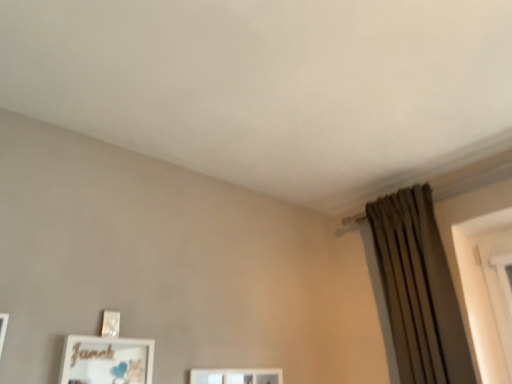
This screenshot has height=384, width=512. What do you see at coordinates (419, 290) in the screenshot?
I see `brown textured curtain at right` at bounding box center [419, 290].

The image size is (512, 384). Find the location of `brown textured curtain at right`. brown textured curtain at right is located at coordinates (419, 290).

Image resolution: width=512 pixels, height=384 pixels. In order to click on matte gold picture frame at lower left in this screenshot , I will do `click(106, 360)`.

What do you see at coordinates (106, 360) in the screenshot? The height and width of the screenshot is (384, 512). I see `matte gold picture frame at lower left` at bounding box center [106, 360].

The width and height of the screenshot is (512, 384). I want to click on brown textured curtain at right, so click(x=419, y=290).

Visually, is brown textured curtain at right positioned to the left or to the right of matte gold picture frame at lower left?

brown textured curtain at right is to the right of matte gold picture frame at lower left.

Which object is more forward, brown textured curtain at right or matte gold picture frame at lower left?

matte gold picture frame at lower left is more forward.

Is point (425, 227) closer or farther from the camera than point (140, 368)?

Point (425, 227).

From the image's perspective, between brown textured curtain at right and matte gold picture frame at lower left, who is located below?

matte gold picture frame at lower left, from the image's perspective.

From a real-world perspective, which is physically above, brown textured curtain at right or matte gold picture frame at lower left?

brown textured curtain at right, from a real-world perspective.

Can you confirm if brown textured curtain at right is thinner than matte gold picture frame at lower left?

No.

Can you confirm if brown textured curtain at right is taller than matte gold picture frame at lower left?

Indeed, brown textured curtain at right has a greater height compared to matte gold picture frame at lower left.

Considering the sizes of brown textured curtain at right and matte gold picture frame at lower left in the image, is brown textured curtain at right bigger or smaller than matte gold picture frame at lower left?

In the image, brown textured curtain at right appears to be larger than matte gold picture frame at lower left.

Is brown textured curtain at right inside the boundaries of matte gold picture frame at lower left, or outside?

brown textured curtain at right is outside matte gold picture frame at lower left.

Is brown textured curtain at right not near matte gold picture frame at lower left?

Yes, brown textured curtain at right and matte gold picture frame at lower left are located far from each other.

Does brown textured curtain at right turn towards matte gold picture frame at lower left?

No, brown textured curtain at right does not turn towards matte gold picture frame at lower left.

Can you tell me how much brown textured curtain at right and matte gold picture frame at lower left differ in facing direction?

The angle between the facing direction of brown textured curtain at right and the facing direction of matte gold picture frame at lower left is 89.6 degrees.

Where is `curtain behind the matte gold picture frame at lower left`? This screenshot has height=384, width=512. curtain behind the matte gold picture frame at lower left is located at coordinates (419, 290).

Would you say matte gold picture frame at lower left is to the left or to the right of brown textured curtain at right in the picture?

In the image, matte gold picture frame at lower left appears on the left side of brown textured curtain at right.

Considering the positions of objects matte gold picture frame at lower left and brown textured curtain at right in the image provided, who is behind, matte gold picture frame at lower left or brown textured curtain at right?

brown textured curtain at right is more distant.

Between point (62, 360) and point (410, 223), which one is positioned behind?

The point (410, 223) is farther from the camera.

From the image's perspective, is matte gold picture frame at lower left positioned above or below brown textured curtain at right?

Clearly, from the image's perspective, matte gold picture frame at lower left is below brown textured curtain at right.

From a real-world perspective, does matte gold picture frame at lower left sit lower than brown textured curtain at right?

Yes, from a real-world perspective, matte gold picture frame at lower left is below brown textured curtain at right.

Which of these two, matte gold picture frame at lower left or brown textured curtain at right, is thinner?

matte gold picture frame at lower left is thinner.

Considering the sizes of matte gold picture frame at lower left and brown textured curtain at right in the image, is matte gold picture frame at lower left taller or shorter than brown textured curtain at right?

In the image, matte gold picture frame at lower left appears to be shorter than brown textured curtain at right.

Can you confirm if matte gold picture frame at lower left is bigger than brown textured curtain at right?

Incorrect, matte gold picture frame at lower left is not larger than brown textured curtain at right.

Is brown textured curtain at right a part of matte gold picture frame at lower left?

Actually, brown textured curtain at right is outside matte gold picture frame at lower left.

Are matte gold picture frame at lower left and brown textured curtain at right making contact?

matte gold picture frame at lower left and brown textured curtain at right are clearly separated.

Is matte gold picture frame at lower left oriented away from brown textured curtain at right?

matte gold picture frame at lower left does not have its back to brown textured curtain at right.

What's the angular difference between matte gold picture frame at lower left and brown textured curtain at right's facing directions?

matte gold picture frame at lower left and brown textured curtain at right are facing 89.6 degrees away from each other.

Measure the distance between matte gold picture frame at lower left and brown textured curtain at right.

matte gold picture frame at lower left is 3.85 feet away from brown textured curtain at right.

This screenshot has width=512, height=384. I want to click on curtain above the matte gold picture frame at lower left (from the image's perspective), so click(419, 290).

Identify the location of picture frame that appears below the brown textured curtain at right (from a real-world perspective). (106, 360).

You are a GUI agent. You are given a task and a screenshot of the screen. Output one action in this format:
    pyautogui.click(x=<x>, y=<y>)
    Task: Click on the curtain behind the matte gold picture frame at lower left
    The height and width of the screenshot is (384, 512).
    Given the screenshot: What is the action you would take?
    pyautogui.click(x=419, y=290)